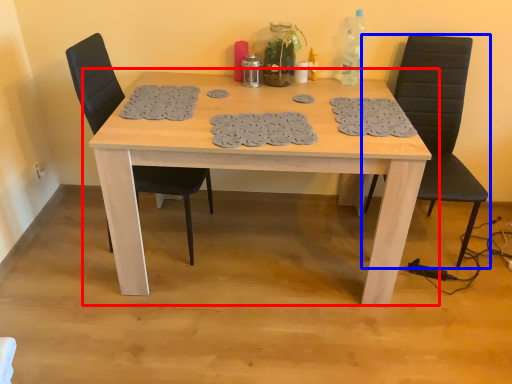
Question: Which object appears farthest to the camera in this image, table (highlighted by a red box) or chair (highlighted by a blue box)?

Choices:
 (A) table
 (B) chair

Answer: (B)